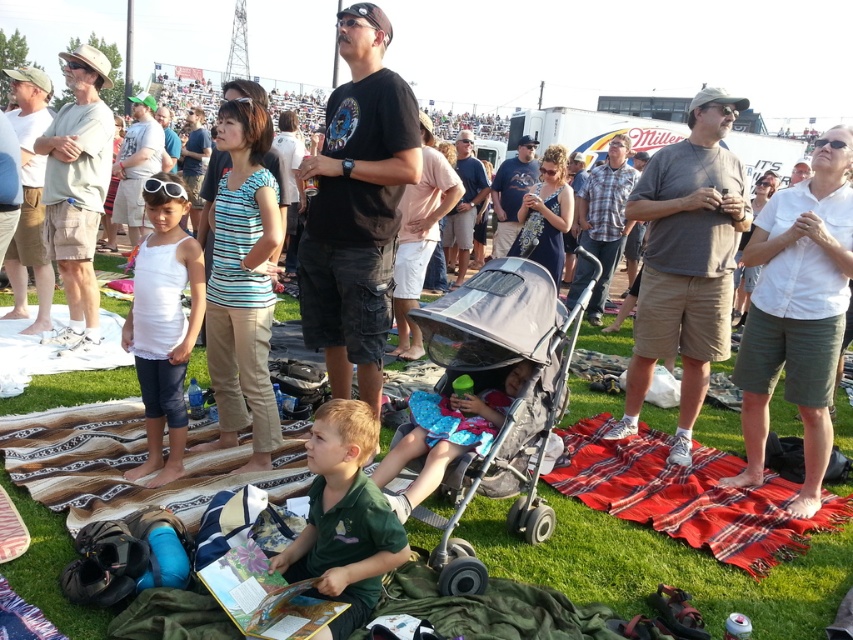
How much distance is there between black cotton t-shirt at center and blue fabric stroller at center?

black cotton t-shirt at center is 77.06 centimeters away from blue fabric stroller at center.

Can you confirm if black cotton t-shirt at center is positioned above blue fabric stroller at center?

Correct, black cotton t-shirt at center is located above blue fabric stroller at center.

Is point (358, 230) behind point (444, 416)?

That is True.

Identify the location of black cotton t-shirt at center. (357, 208).

Which is more to the left, black cotton t-shirt at center or gray fabric stroller at center?

Positioned to the left is black cotton t-shirt at center.

Can you confirm if black cotton t-shirt at center is positioned below gray fabric stroller at center?

Incorrect, black cotton t-shirt at center is not positioned below gray fabric stroller at center.

Find the location of `black cotton t-shirt at center`. black cotton t-shirt at center is located at coordinates (357, 208).

At what (x,y) coordinates should I click in order to perform the action: click on black cotton t-shirt at center. Please return your answer as a coordinate pair (x, y). The height and width of the screenshot is (640, 853). Looking at the image, I should click on (357, 208).

Can you confirm if white cotton shirt at center is taller than green matte shirt at center?

Yes.

Is white cotton shirt at center bigger than green matte shirt at center?

Yes, white cotton shirt at center is bigger than green matte shirt at center.

Describe the element at coordinates (798, 310) in the screenshot. I see `white cotton shirt at center` at that location.

At what (x,y) coordinates should I click in order to perform the action: click on white cotton shirt at center. Please return your answer as a coordinate pair (x, y). The width and height of the screenshot is (853, 640). Looking at the image, I should click on (798, 310).